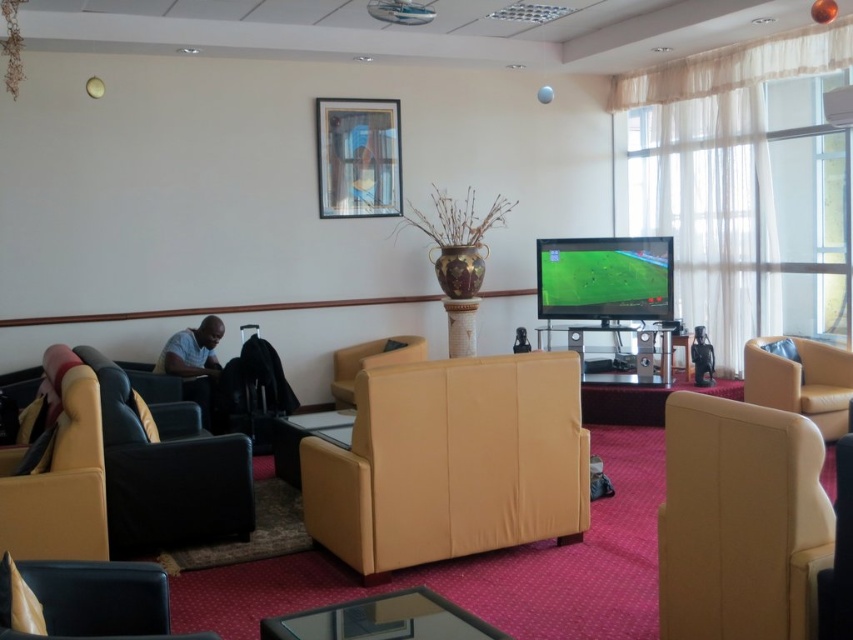
Is leather at right thinner than matte yellow armchair at center?

Yes.

Who is more distant from viewer, (x=773, y=467) or (x=355, y=358)?

The point (x=355, y=358) is behind.

Which is in front, point (720, 536) or point (354, 362)?

Point (720, 536)

I want to click on leather at right, so click(740, 522).

Can you confirm if matte yellow armchair at right is wider than transparent glass table at center?

No.

Is matte yellow armchair at right positioned at the back of transparent glass table at center?

That is True.

Between point (821, 356) and point (339, 412), which one is positioned in front?

Point (339, 412) is more forward.

Where is `matte yellow armchair at right`? The image size is (853, 640). matte yellow armchair at right is located at coordinates (799, 380).

Which of these two, matte yellow leather couch at center or matte yellow armchair at center, stands taller?

matte yellow leather couch at center

Does matte yellow leather couch at center have a greater height compared to matte yellow armchair at center?

Indeed, matte yellow leather couch at center has a greater height compared to matte yellow armchair at center.

Measure the distance between matte yellow leather couch at center and camera.

matte yellow leather couch at center and camera are 3.38 meters apart.

Identify the location of matte yellow leather couch at center. (451, 461).